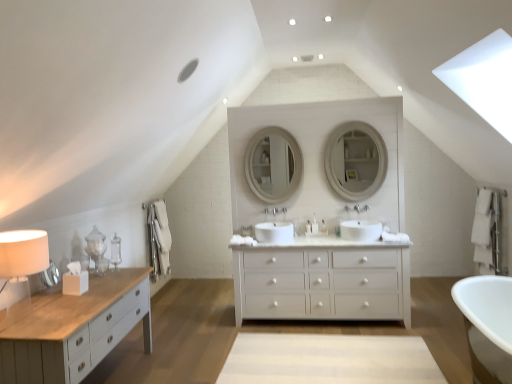
Question: Is white glossy sink at center, the 1th sink in the left-to-right sequence, facing away from white glossy mirror at center, acting as the second mirror starting from the right?

Choices:
 (A) yes
 (B) no

Answer: (B)

Question: Is white glossy sink at center, the second sink in the right-to-left sequence, bigger than white glossy mirror at center, the first mirror in the left-to-right sequence?

Choices:
 (A) yes
 (B) no

Answer: (B)

Question: Is white glossy sink at center, the 1th sink in the left-to-right sequence, wider than white glossy mirror at center, acting as the second mirror starting from the right?

Choices:
 (A) no
 (B) yes

Answer: (B)

Question: Would you say white glossy sink at center, the 1th sink in the left-to-right sequence, is outside white glossy mirror at center, acting as the second mirror starting from the right?

Choices:
 (A) no
 (B) yes

Answer: (B)

Question: Is white glossy mirror at center, the first mirror in the left-to-right sequence, inside white glossy sink at center, the 1th sink in the left-to-right sequence?

Choices:
 (A) no
 (B) yes

Answer: (A)

Question: From the image's perspective, is white glossy sink at center, the second sink in the right-to-left sequence, on top of white glossy mirror at center, the first mirror in the left-to-right sequence?

Choices:
 (A) yes
 (B) no

Answer: (B)

Question: Does white glossy toiletry at center, which is counted as the second toiletry, starting from the left, lie behind white glossy sink at center, the second sink in the right-to-left sequence?

Choices:
 (A) yes
 (B) no

Answer: (A)

Question: Can you confirm if white glossy toiletry at center, the 2th toiletry in the right-to-left sequence, is smaller than white glossy sink at center, the 1th sink in the left-to-right sequence?

Choices:
 (A) no
 (B) yes

Answer: (B)

Question: From a real-world perspective, is white glossy toiletry at center, which is counted as the second toiletry, starting from the left, over white glossy sink at center, the second sink in the right-to-left sequence?

Choices:
 (A) yes
 (B) no

Answer: (A)

Question: From the image's perspective, is white glossy toiletry at center, which is counted as the second toiletry, starting from the left, below white glossy sink at center, the 1th sink in the left-to-right sequence?

Choices:
 (A) no
 (B) yes

Answer: (A)

Question: Is white glossy toiletry at center, which is counted as the second toiletry, starting from the left, located outside white glossy sink at center, the 1th sink in the left-to-right sequence?

Choices:
 (A) yes
 (B) no

Answer: (A)

Question: Can you confirm if white glossy faucet at center, the second faucet positioned from the right, is shorter than white glossy mirror at center, the first mirror in the left-to-right sequence?

Choices:
 (A) yes
 (B) no

Answer: (A)